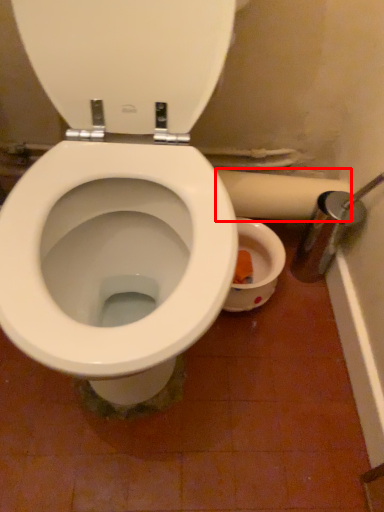
Question: From the image, what is the correct spatial relationship of toilet paper (annotated by the red box) in relation to back?

Choices:
 (A) left
 (B) right

Answer: (B)